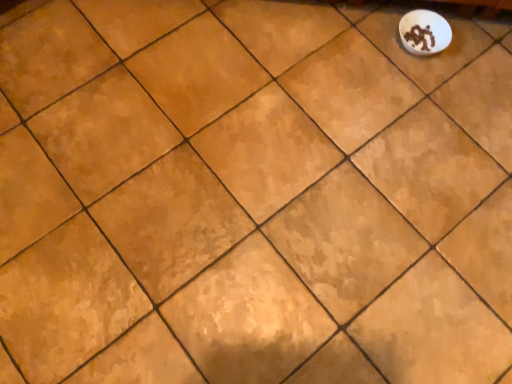
I want to click on white glossy bowl at upper right, so click(x=424, y=32).

What is the approximate width of white glossy bowl at upper right?

white glossy bowl at upper right is 4.94 inches wide.

Image resolution: width=512 pixels, height=384 pixels. What do you see at coordinates (424, 32) in the screenshot?
I see `white glossy bowl at upper right` at bounding box center [424, 32].

Where is `white glossy bowl at upper right`? white glossy bowl at upper right is located at coordinates (424, 32).